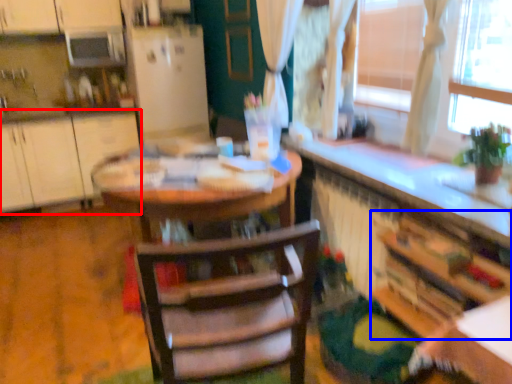
Question: Which of the following is the farthest to the observer, cabinetry (highlighted by a red box) or cabinetry (highlighted by a blue box)?

Choices:
 (A) cabinetry
 (B) cabinetry

Answer: (A)